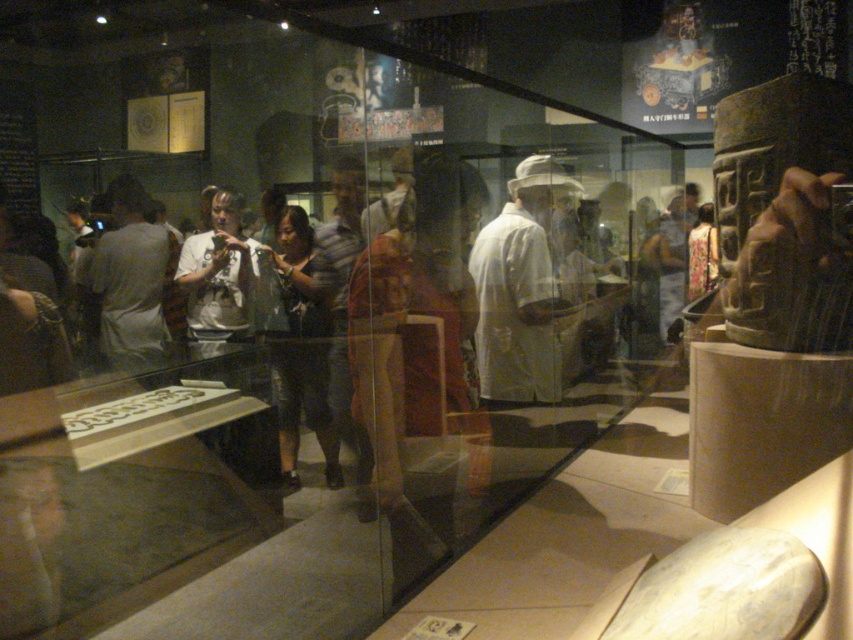
Is white matte shirt at center thinner than dark gray fabric shirt at center?

Incorrect, white matte shirt at center's width is not less than dark gray fabric shirt at center's.

Which is in front, point (503, 259) or point (281, 426)?

Point (281, 426)

The width and height of the screenshot is (853, 640). In order to click on white matte shirt at center in this screenshot , I will do `click(521, 288)`.

Can you confirm if white matte shirt at center is positioned to the right of light gray shirt at left?

Correct, you'll find white matte shirt at center to the right of light gray shirt at left.

This screenshot has width=853, height=640. In order to click on white matte shirt at center in this screenshot , I will do `click(521, 288)`.

Between dark gray fabric shirt at center and light gray shirt at left, which one is positioned lower?

dark gray fabric shirt at center

Does dark gray fabric shirt at center have a larger size compared to light gray shirt at left?

No, dark gray fabric shirt at center is not bigger than light gray shirt at left.

The width and height of the screenshot is (853, 640). Identify the location of dark gray fabric shirt at center. (300, 349).